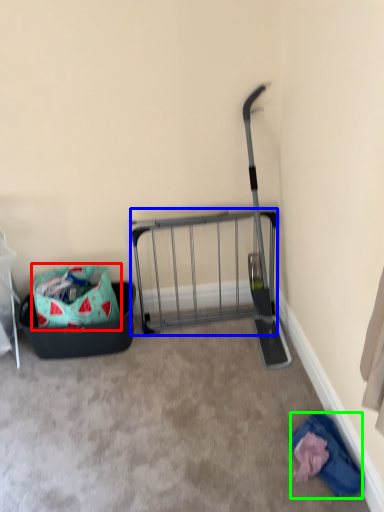
Question: Which object is positioned closest to bag (highlighted by a red box)? Select from cart (highlighted by a blue box) and clothing (highlighted by a green box).

Choices:
 (A) cart
 (B) clothing

Answer: (A)